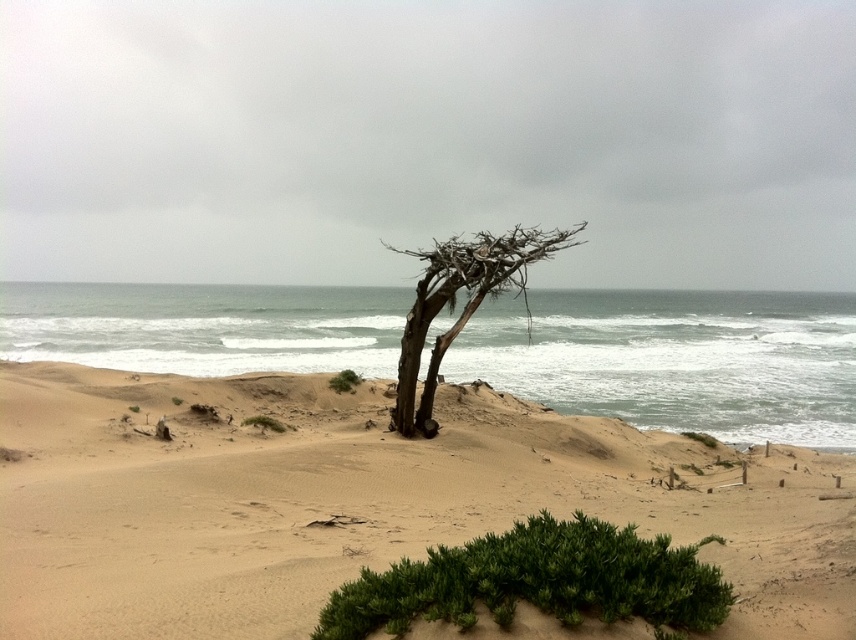
Measure the distance from green leafy bush at lower center to brown rough tree at center.

The distance of green leafy bush at lower center from brown rough tree at center is 33.79 feet.

Is point (697, 625) positioned before point (479, 298)?

Yes.

Is point (623, 573) positioned behind point (394, 406)?

No.

Image resolution: width=856 pixels, height=640 pixels. Find the location of `green leafy bush at lower center`. green leafy bush at lower center is located at coordinates (536, 580).

Does sandy beige sand at center have a lesser height compared to green leafy bush at lower center?

No.

Does point (318, 460) come farther from viewer compared to point (625, 534)?

Yes, it is.

Who is more forward, (197, 596) or (551, 586)?

Point (551, 586)

Where is `sandy beige sand at center`? This screenshot has height=640, width=856. sandy beige sand at center is located at coordinates (360, 502).

Which of these two, sandy beige sand at center or brown rough tree at center, stands shorter?

Standing shorter between the two is sandy beige sand at center.

Is sandy beige sand at center behind brown rough tree at center?

No.

Find the location of a particular element. The width and height of the screenshot is (856, 640). sandy beige sand at center is located at coordinates (360, 502).